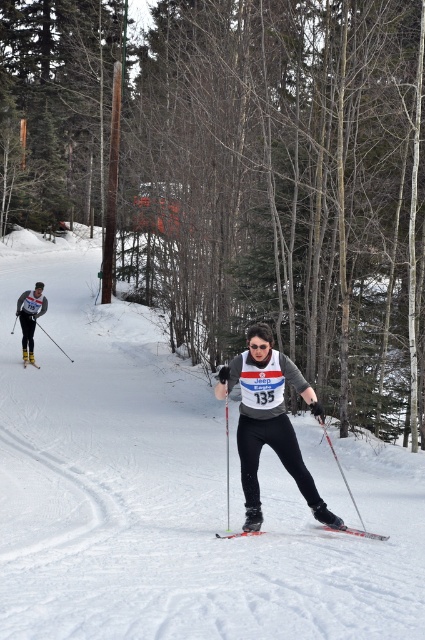
Can you confirm if matte gray ski suit at center is positioned to the right of metallic silver ski at center?

No, matte gray ski suit at center is not to the right of metallic silver ski at center.

From the picture: Who is more distant from viewer, [268,333] or [319,525]?

Point [319,525]

This screenshot has width=425, height=640. I want to click on matte gray ski suit at center, so click(269, 420).

Does red metallic ski at center appear on the right side of metallic silver ski at center?

In fact, red metallic ski at center is to the left of metallic silver ski at center.

Find the location of a particular element. red metallic ski at center is located at coordinates (354, 531).

Does metallic silver ski at center come behind yellow metallic ski at center?

No, it is in front of yellow metallic ski at center.

Who is lower down, metallic silver ski at center or yellow metallic ski at center?

Positioned lower is metallic silver ski at center.

Which is behind, point (359, 532) or point (34, 362)?

The point (34, 362) is behind.

Locate an element on the screen. Image resolution: width=425 pixels, height=640 pixels. metallic silver ski at center is located at coordinates (354, 531).